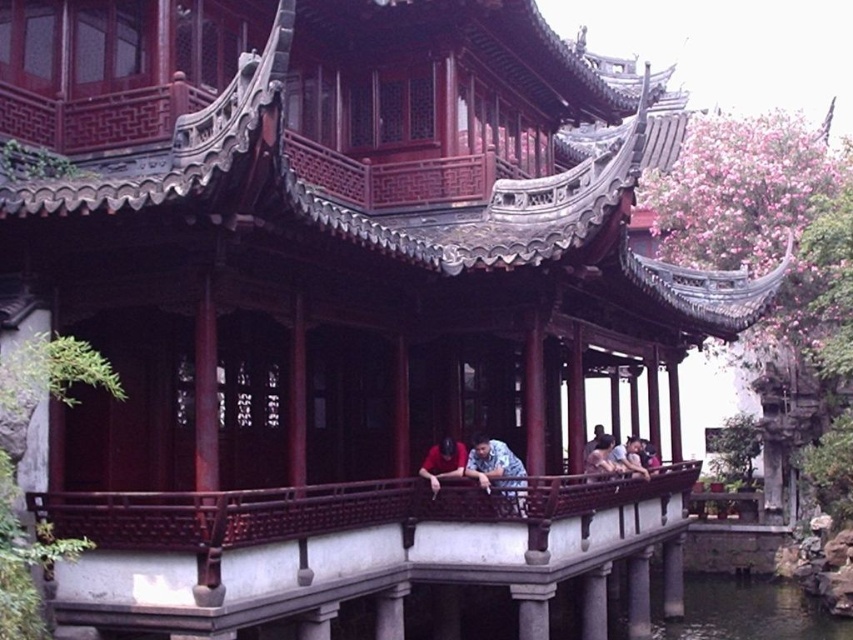
Question: Does matte blue shirt at center appear under light brown wooden bench at center?

Choices:
 (A) yes
 (B) no

Answer: (B)

Question: Can you confirm if printed fabric shirt at center is bigger than matte blue shirt at center?

Choices:
 (A) no
 (B) yes

Answer: (B)

Question: From the image, what is the correct spatial relationship of printed fabric shirt at center in relation to matte blue shirt at center?

Choices:
 (A) above
 (B) below

Answer: (B)

Question: Which object is the closest to the matte blue shirt at center?

Choices:
 (A) light brown wooden bench at center
 (B) printed fabric shirt at center

Answer: (B)

Question: Which object appears farthest from the camera in this image?

Choices:
 (A) light brown wooden bench at center
 (B) light blue fabric shirt at center
 (C) matte blue shirt at center
 (D) printed fabric shirt at center

Answer: (A)

Question: Which point is farther from the camera taking this photo?

Choices:
 (A) (601, 449)
 (B) (636, 474)
 (C) (480, 480)
 (D) (459, 451)

Answer: (B)